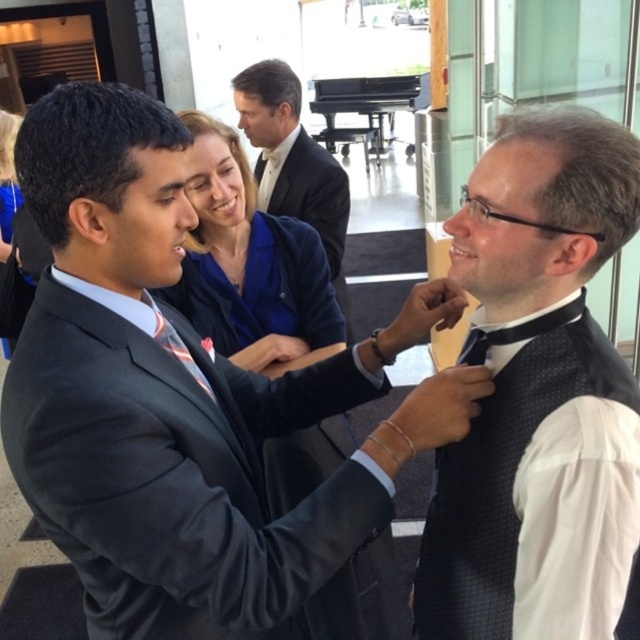
Is dark blue fabric suit at center wider than black satin bow tie at center?

Correct, the width of dark blue fabric suit at center exceeds that of black satin bow tie at center.

Locate an element on the screen. dark blue fabric suit at center is located at coordinates click(x=310, y=202).

The image size is (640, 640). Identify the location of dark blue fabric suit at center. (310, 202).

Between black dotted vest at right and blue fabric jacket at upper center, which one has less height?

black dotted vest at right

Is point (556, 317) closer to camera compared to point (243, 273)?

Yes, point (556, 317) is closer to viewer.

Which is behind, point (628, 484) or point (284, 460)?

Positioned behind is point (284, 460).

Locate an element on the screen. The image size is (640, 640). black dotted vest at right is located at coordinates (540, 396).

Does black dotted vest at right have a greater height compared to dark blue fabric suit at center?

Correct, black dotted vest at right is much taller as dark blue fabric suit at center.

Which is below, black dotted vest at right or dark blue fabric suit at center?

Positioned lower is black dotted vest at right.

Is point (522, 150) in front of point (272, 202)?

That is True.

The width and height of the screenshot is (640, 640). In order to click on black dotted vest at right in this screenshot , I will do `click(540, 396)`.